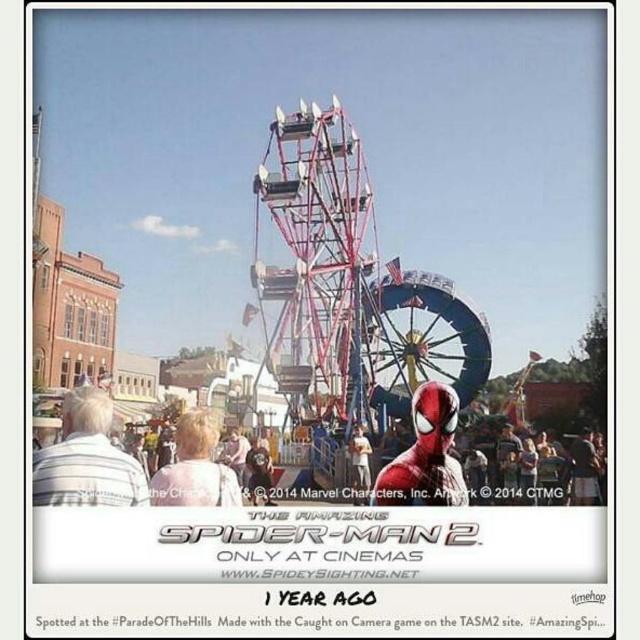
You are a visitor at the carnival and want to take a photo of both the metallic red ferris wheel at center and the metallic ferris wheel at center. How far apart are these two attractions?

The distance between the metallic red ferris wheel at center and the metallic ferris wheel at center is 31.17 meters.

You are at the carnival and want to take a photo of both the metallic red ferris wheel at center and the metallic ferris wheel at center. Which one should you stand closer to in order to capture both in a single frame?

Both the metallic red ferris wheel at center and the metallic ferris wheel at center are the same object, so you don

You are standing at the center of the fairground and see a point marked at coordinates [129,465]. What object is located at that point?

The point at [129,465] indicates a matte red costume at center.